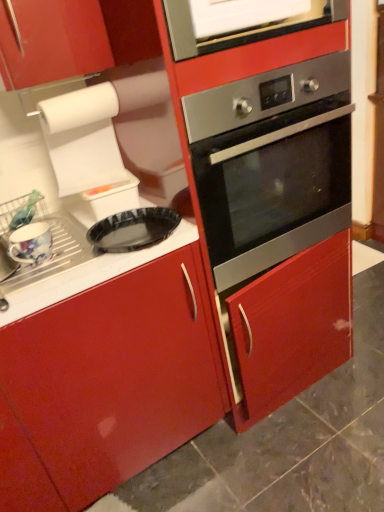
You are a GUI agent. You are given a task and a screenshot of the screen. Output one action in this format:
    pyautogui.click(x=<x>, y=<y>)
    Task: Click on the vacant space in black glossy pizza pan at center (from a real-world perspective)
    The height and width of the screenshot is (512, 384).
    Given the screenshot: What is the action you would take?
    pyautogui.click(x=195, y=443)